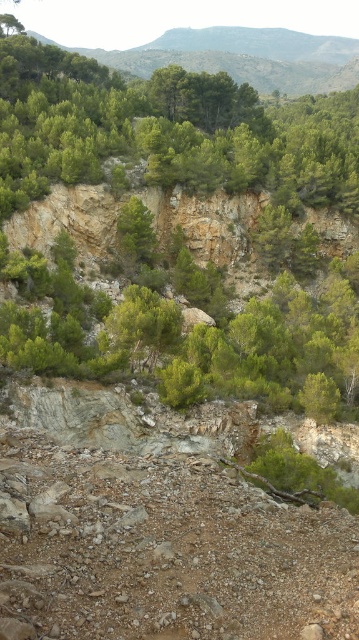
Who is more forward, [232,515] or [143,234]?

Positioned in front is point [232,515].

Does brown gravel dirt track at lower center have a greater height compared to green rough bark tree at center?

Correct, brown gravel dirt track at lower center is much taller as green rough bark tree at center.

Is point (282, 595) positioned after point (147, 236)?

No, it is not.

Find the location of a particular element. The image size is (359, 640). brown gravel dirt track at lower center is located at coordinates [x=166, y=550].

Does brown gravel dirt track at lower center have a greater height compared to green matte tree at center?

Incorrect, brown gravel dirt track at lower center's height is not larger of green matte tree at center's.

Image resolution: width=359 pixels, height=640 pixels. What do you see at coordinates (166, 550) in the screenshot?
I see `brown gravel dirt track at lower center` at bounding box center [166, 550].

Between point (178, 532) and point (110, 339), which one is positioned behind?

Point (110, 339)

The height and width of the screenshot is (640, 359). I want to click on brown gravel dirt track at lower center, so click(166, 550).

Does green matte tree at center appear under green rough bark tree at center?

Yes, green matte tree at center is below green rough bark tree at center.

Is green matte tree at center thinner than green rough bark tree at center?

No.

Is point (119, 305) closer to camera compared to point (146, 218)?

That is True.

This screenshot has height=640, width=359. In order to click on green matte tree at center in this screenshot , I will do `click(143, 324)`.